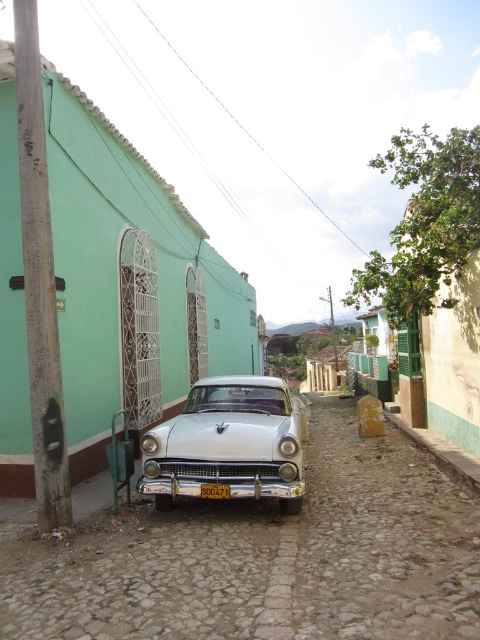
Question: Which of the following is the farthest from the observer?

Choices:
 (A) (227, 492)
 (B) (304, 547)

Answer: (A)

Question: Which point is closer to the camera?

Choices:
 (A) white glossy car at center
 (B) yellow matte license plate at center
 (C) metallic silver car at center

Answer: (C)

Question: Which point appears farthest from the camera in this image?

Choices:
 (A) (196, 611)
 (B) (219, 490)

Answer: (B)

Question: Where is white glossy car at center located in relation to yellow matte license plate at center in the image?

Choices:
 (A) below
 (B) above

Answer: (B)

Question: Can you confirm if metallic silver car at center is thinner than yellow matte license plate at center?

Choices:
 (A) no
 (B) yes

Answer: (A)

Question: Does metallic silver car at center appear under yellow matte license plate at center?

Choices:
 (A) yes
 (B) no

Answer: (A)